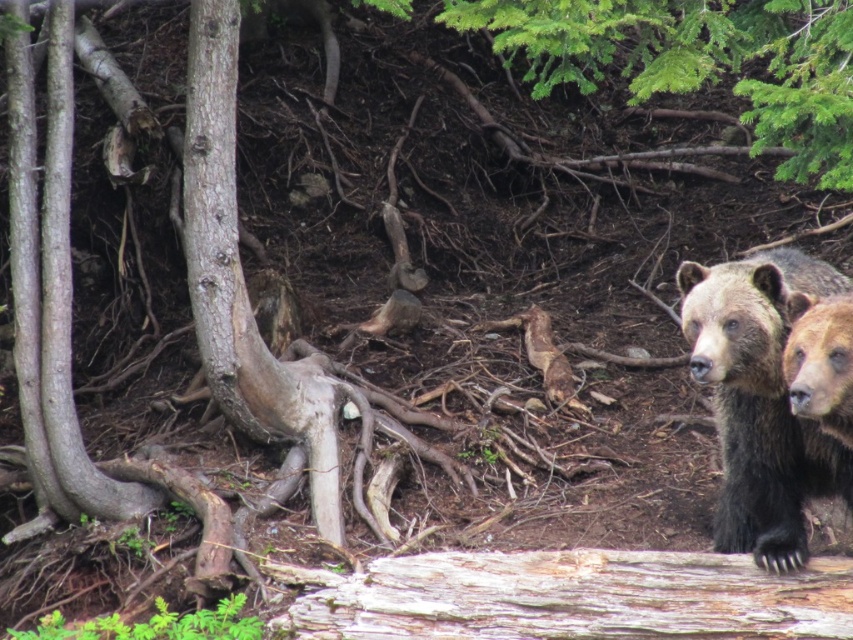
Does weathered wood at lower right have a smaller size compared to smooth brown bark at center?

Yes, weathered wood at lower right is smaller than smooth brown bark at center.

Can you confirm if weathered wood at lower right is thinner than smooth brown bark at center?

No, weathered wood at lower right is not thinner than smooth brown bark at center.

At what (x,y) coordinates should I click in order to perform the action: click on weathered wood at lower right. Please return your answer as a coordinate pair (x, y). Looking at the image, I should click on (572, 596).

Can you confirm if weathered wood at lower right is positioned to the right of brown fur bear at right?

Incorrect, weathered wood at lower right is not on the right side of brown fur bear at right.

Is weathered wood at lower right wider than brown fur bear at right?

Correct, the width of weathered wood at lower right exceeds that of brown fur bear at right.

Does point (619, 576) come in front of point (796, 496)?

That is True.

Locate an element on the screen. weathered wood at lower right is located at coordinates (572, 596).

Does brown fur bear at right have a smaller size compared to smooth brown bark at center?

Correct, brown fur bear at right occupies less space than smooth brown bark at center.

Does point (715, 332) come closer to viewer compared to point (227, 77)?

Yes, point (715, 332) is in front of point (227, 77).

What are the coordinates of `brown fur bear at right` in the screenshot? It's located at (759, 401).